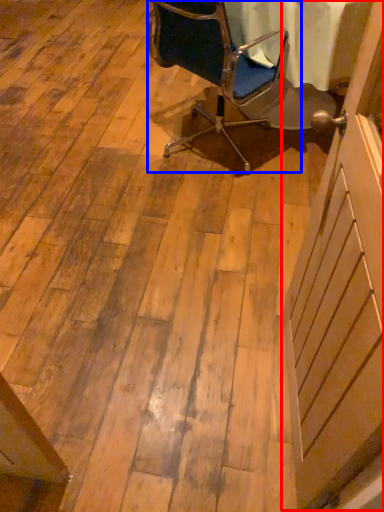
Question: Among these objects, which one is nearest to the camera, screen door (highlighted by a red box) or chair (highlighted by a blue box)?

Choices:
 (A) screen door
 (B) chair

Answer: (A)